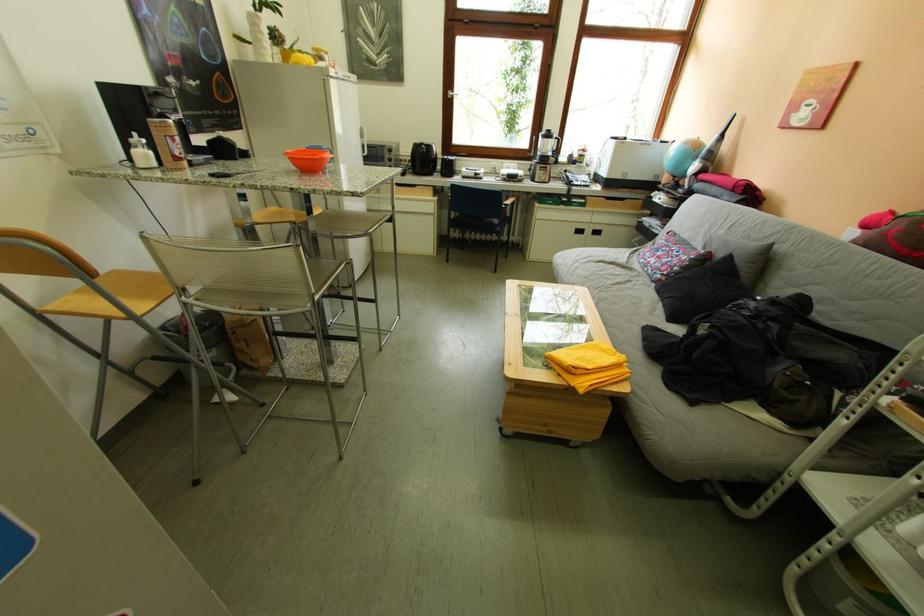
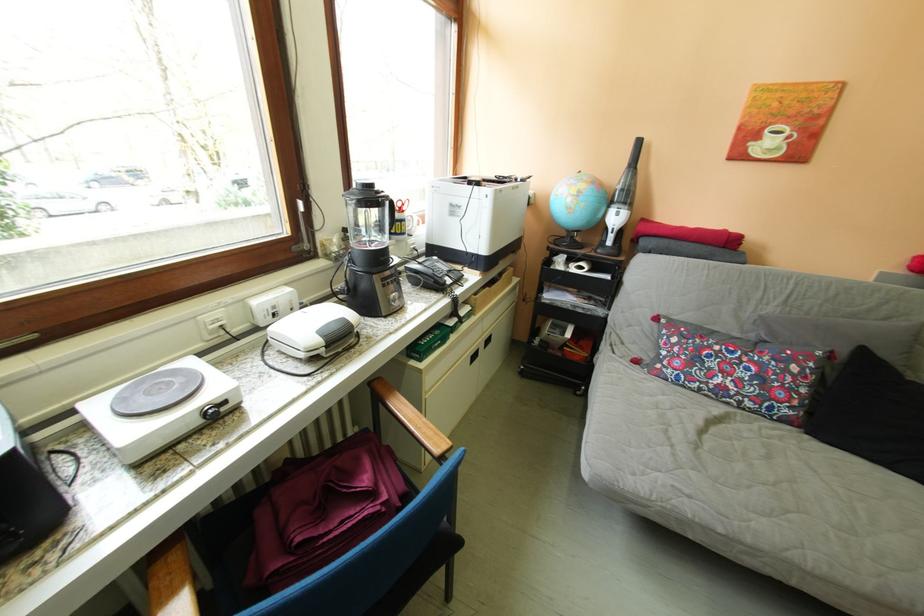
The point at (492, 177) is marked in the first image. Where is the corresponding point in the second image?

(237, 406)